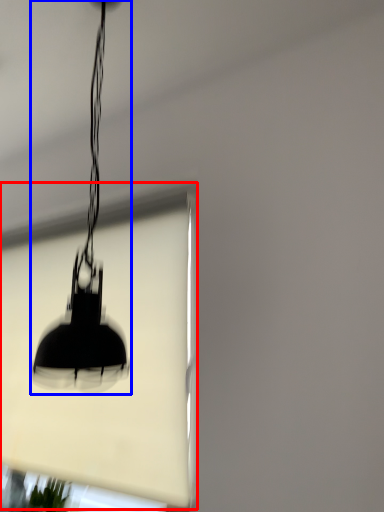
Question: Among these objects, which one is nearest to the camera, window screen (highlighted by a red box) or lamp (highlighted by a blue box)?

Choices:
 (A) window screen
 (B) lamp

Answer: (B)